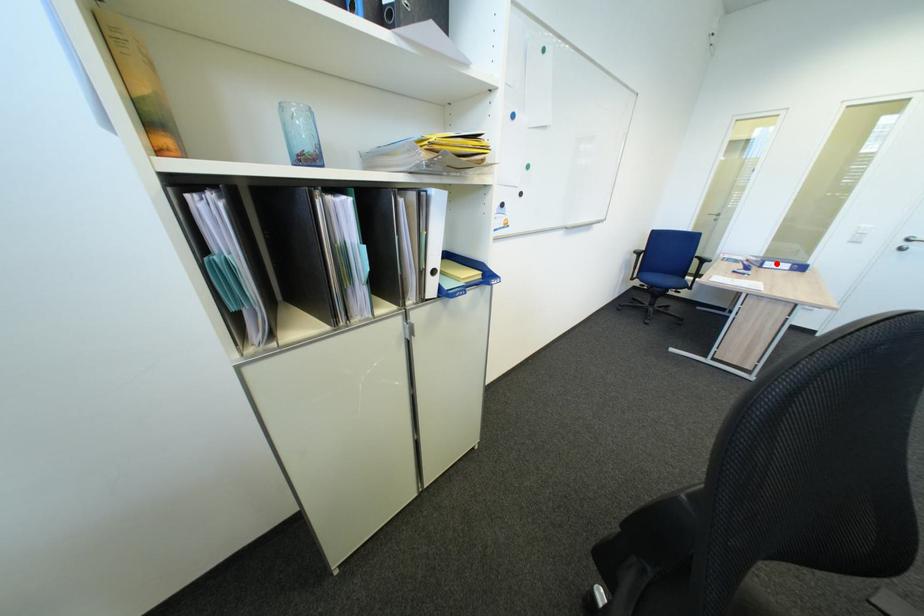
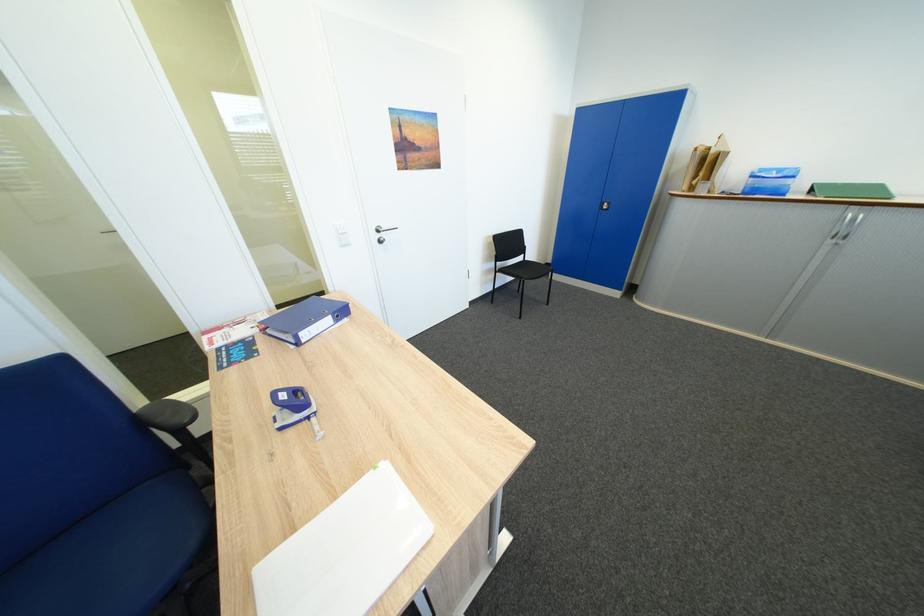
Find the pixel in the second image that matches the highlighted location in the first image.

(310, 334)